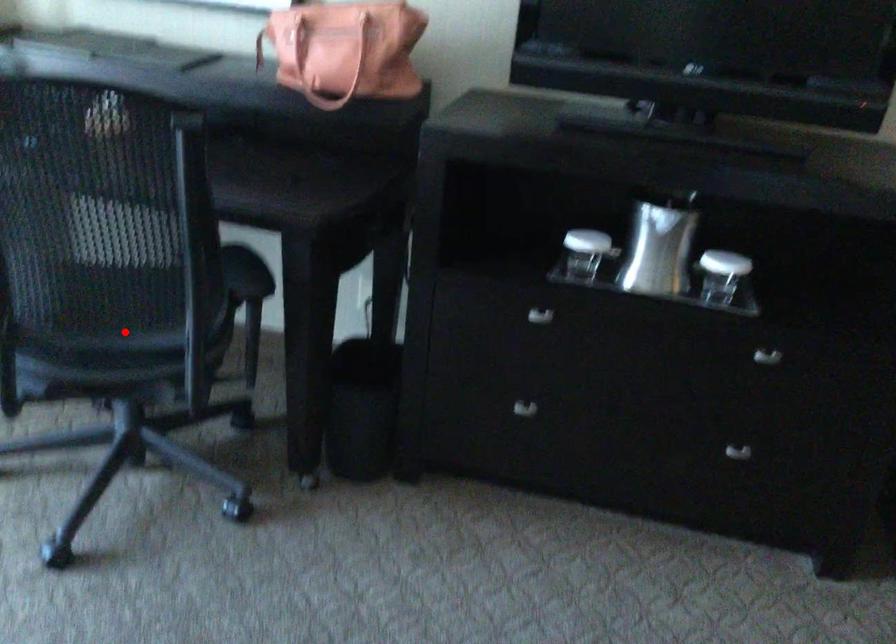
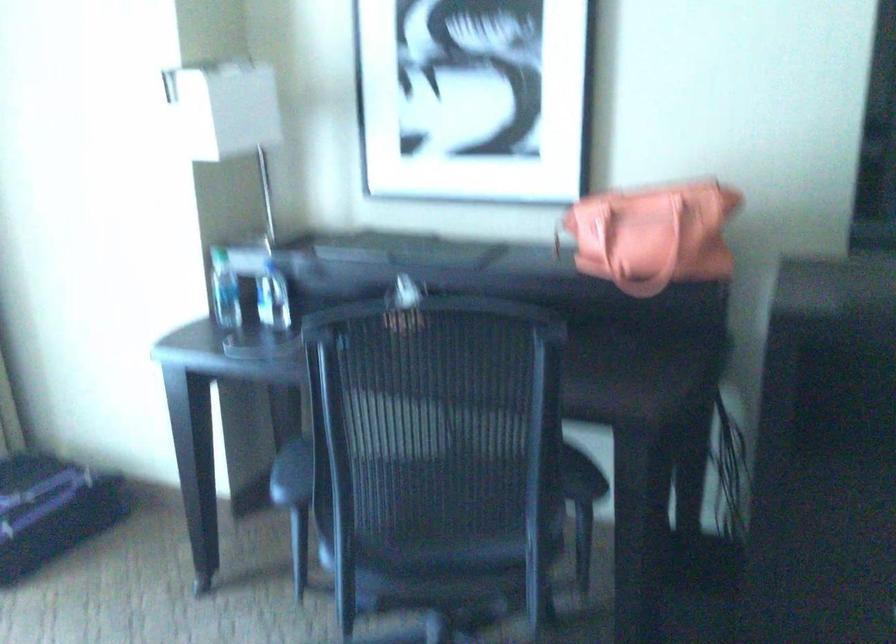
Find the pixel in the second image that matches the highlighted location in the first image.

(458, 544)